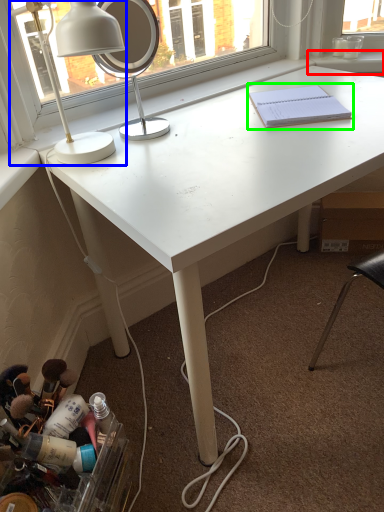
Question: Estimate the real-world distances between objects in this image. Which object is closer to window sill (highlighted by a red box), lamp (highlighted by a blue box) or notebook (highlighted by a green box)?

Choices:
 (A) lamp
 (B) notebook

Answer: (B)